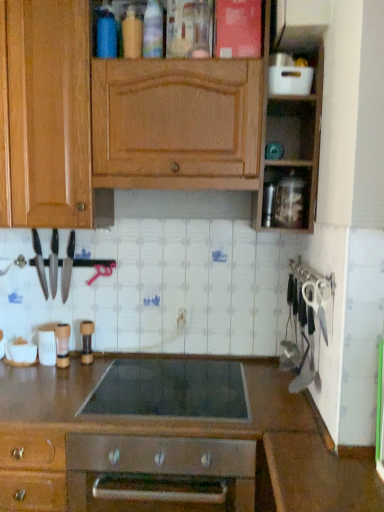
Find the location of a particular element. This screenshot has width=384, height=512. vacant space to the right of brown matte pepper grinder at center, marked as the 3th appliance in a right-to-left arrangement is located at coordinates (120, 365).